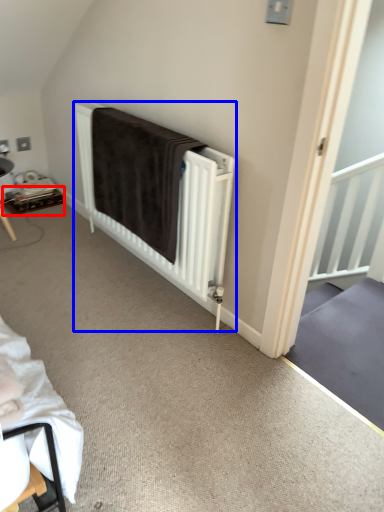
Question: Which object is closer to the camera taking this photo, table (highlighted by a red box) or bed (highlighted by a blue box)?

Choices:
 (A) table
 (B) bed

Answer: (B)